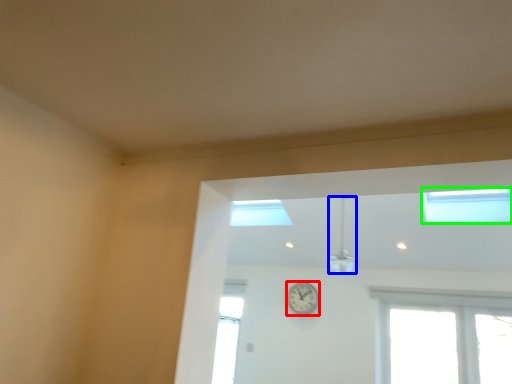
Question: Which object is the farthest from clock (highlighted by a red box)? Choose among these: light fixture (highlighted by a blue box) or window (highlighted by a green box).

Choices:
 (A) light fixture
 (B) window

Answer: (B)